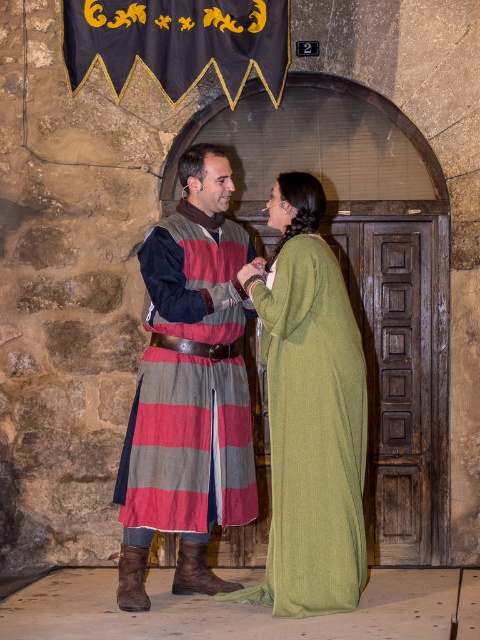
Which of these two, striped wool tunic at center or green woolen dress at center, stands shorter?

Standing shorter between the two is green woolen dress at center.

Is striped wool tunic at center shorter than green woolen dress at center?

In fact, striped wool tunic at center may be taller than green woolen dress at center.

Where is `striped wool tunic at center`? striped wool tunic at center is located at coordinates (189, 388).